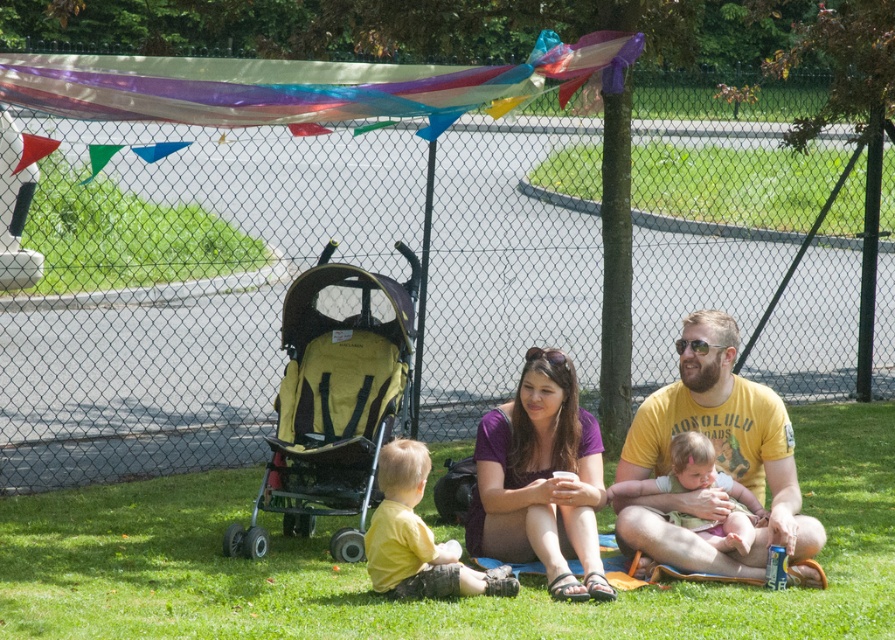
Does yellow matte shirt at lower center have a greater width compared to soft pink fabric at center?

No.

Is yellow matte shirt at lower center positioned behind soft pink fabric at center?

That is False.

Is point (505, 593) farther from viewer compared to point (697, 474)?

No, it is in front of (697, 474).

I want to click on yellow matte shirt at lower center, so click(416, 536).

Is green grass at center to the left of soft pink fabric at center from the viewer's perspective?

Correct, you'll find green grass at center to the left of soft pink fabric at center.

Who is positioned more to the left, green grass at center or soft pink fabric at center?

green grass at center is more to the left.

Find the location of `green grass at center`. green grass at center is located at coordinates (422, 602).

Does yellow fabric stroller at left appear on the right side of purple fabric at center?

Incorrect, yellow fabric stroller at left is not on the right side of purple fabric at center.

Does yellow fabric stroller at left have a greater width compared to purple fabric at center?

Yes.

Between point (275, 442) and point (491, 417), which one is positioned in front?

Positioned in front is point (491, 417).

Where is `yellow fabric stroller at left`? yellow fabric stroller at left is located at coordinates (333, 400).